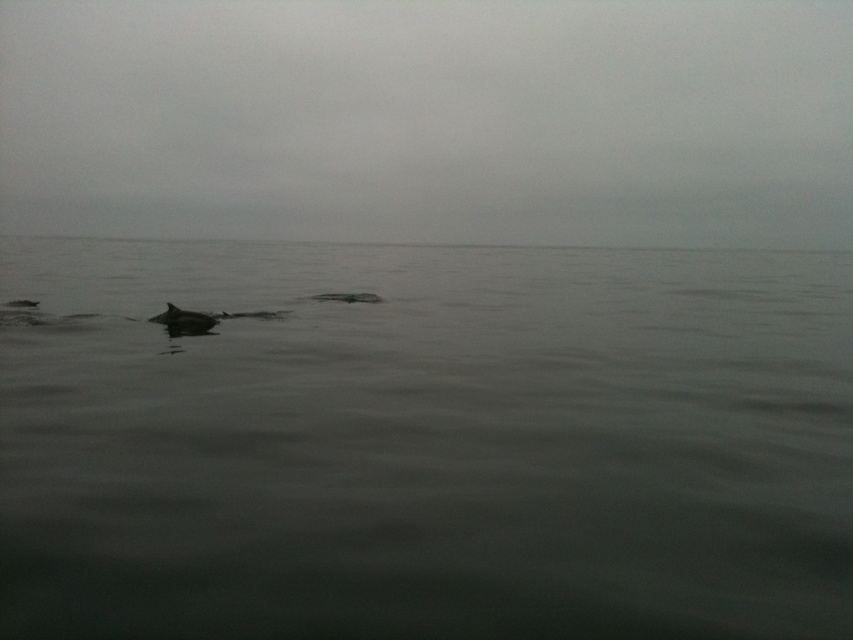
You are a marine biologist observing the ocean scene. You notice a point at coordinates (425, 444). What is located at that point?

The gray matte water at center is located at point (425, 444).

You are a marine biologist observing the ocean scene. You notice the gray matte water at center. Based on its coordinates, can you determine if it is positioned closer to the top or bottom of the image?

The gray matte water at center is located at point 0.694 on the vertical axis, which places it closer to the bottom of the image since 0.694 is more than halfway down the vertical scale.

Looking at this image, you are standing on a boat and want to know how far the point at coordinates point (524, 609) is from you. Can you determine the distance?

The point (524, 609) is 10.14 feet from the camera, so the distance from you to that point is 10.14 feet.